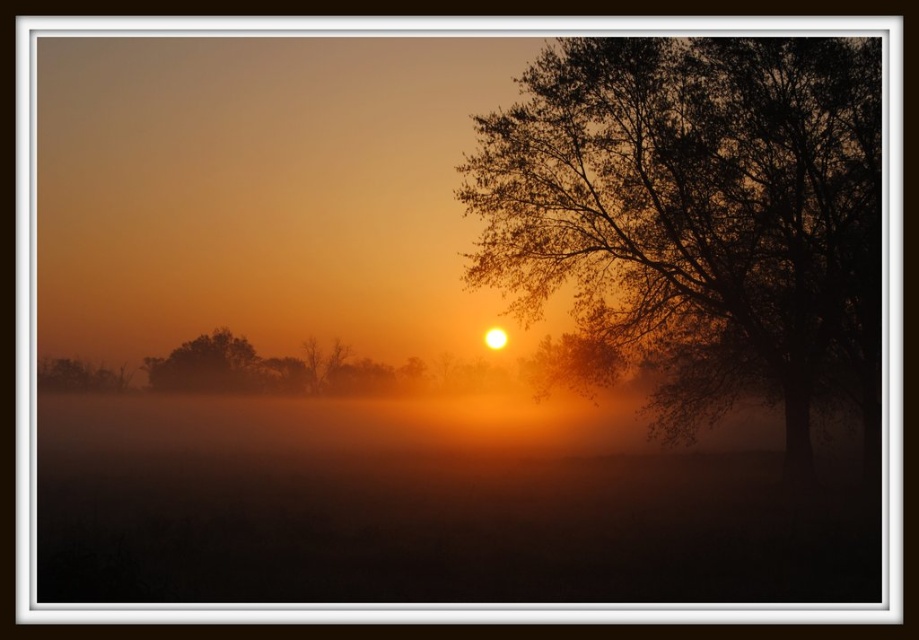
Is silhouette leafy tree at right thinner than silhouette tree at left?

Incorrect, silhouette leafy tree at right's width is not less than silhouette tree at left's.

Is silhouette leafy tree at right smaller than silhouette tree at left?

Incorrect, silhouette leafy tree at right is not smaller in size than silhouette tree at left.

Is point (651, 97) closer to camera compared to point (259, 358)?

Yes, point (651, 97) is closer to viewer.

The width and height of the screenshot is (919, 640). Identify the location of silhouette leafy tree at right. (699, 216).

In the scene shown: Does silhouette tree at left have a smaller size compared to smooth bark tree at right?

Incorrect, silhouette tree at left is not smaller in size than smooth bark tree at right.

Is point (217, 353) positioned after point (562, 346)?

Yes, point (217, 353) is farther from viewer.

Is point (225, 355) positioned before point (573, 358)?

That is False.

This screenshot has height=640, width=919. Find the location of `silhouette tree at left`. silhouette tree at left is located at coordinates (206, 365).

Does silhouette leafy tree at right have a smaller size compared to smooth bark tree at right?

No, silhouette leafy tree at right is not smaller than smooth bark tree at right.

Can you confirm if silhouette leafy tree at right is taller than smooth bark tree at right?

Yes.

Locate an element on the screen. The width and height of the screenshot is (919, 640). silhouette leafy tree at right is located at coordinates (699, 216).